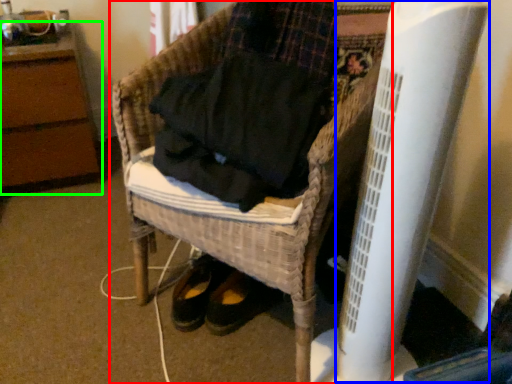
Question: Based on their relative distances, which object is farther from furniture (highlighted by a red box)? Choose from radiator (highlighted by a blue box) and furniture (highlighted by a green box).

Choices:
 (A) radiator
 (B) furniture

Answer: (B)